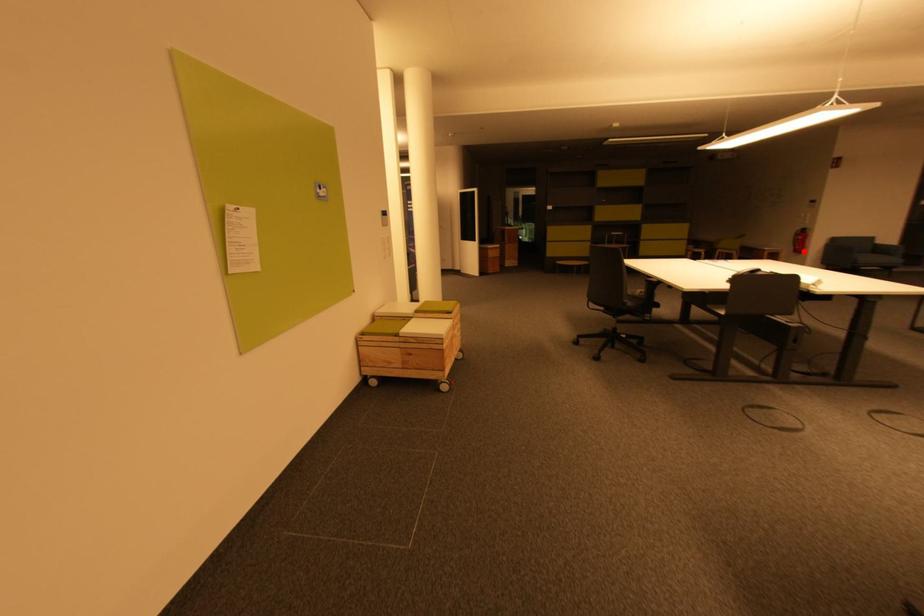
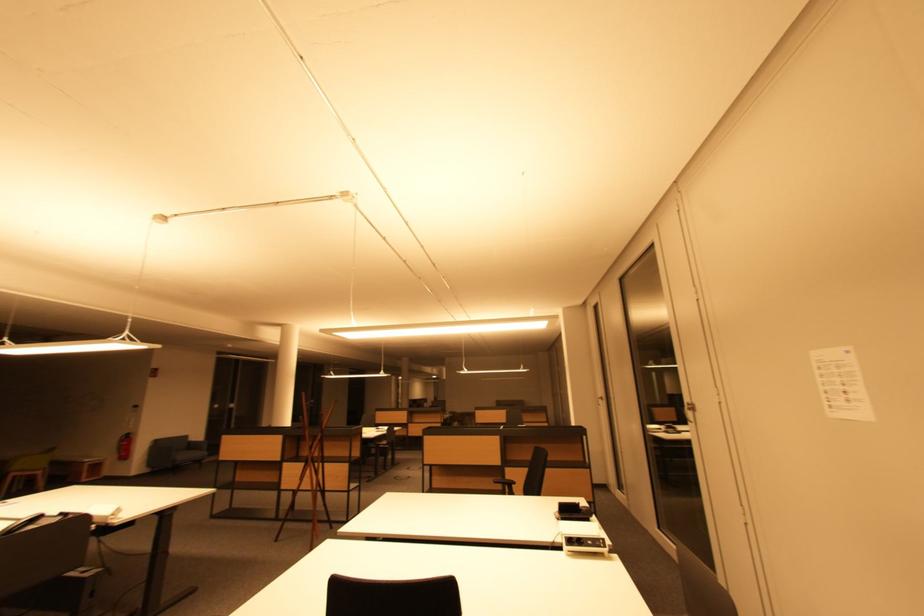
Where in the second image is the point corresponding to the highlighted location from the first image?

(128, 458)